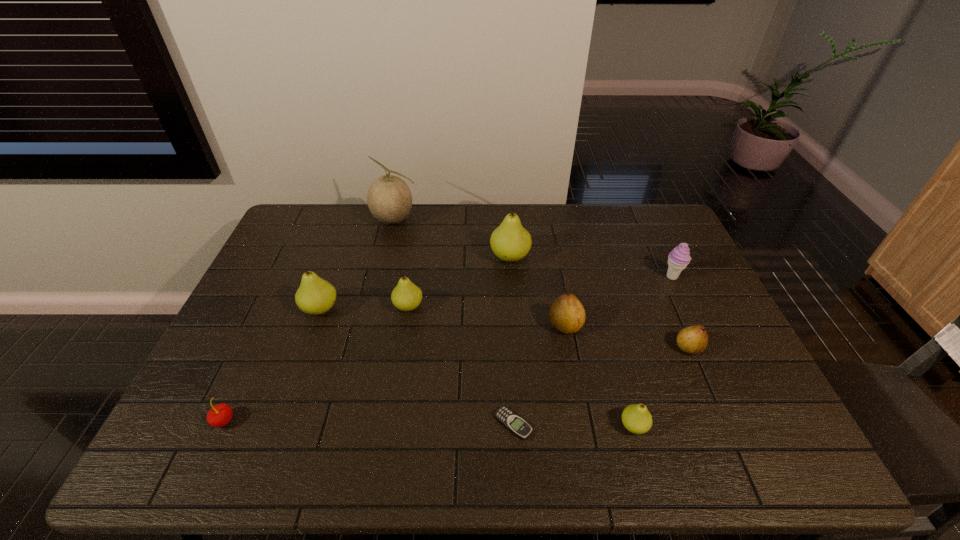
In the image, there is a desktop. Find the location of `free region at the far right corner`. free region at the far right corner is located at coordinates (628, 222).

The image size is (960, 540). What are the coordinates of `blank region between the leftmost object and the gray beeper` in the screenshot? It's located at (369, 422).

Find the location of a particular element. The height and width of the screenshot is (540, 960). free space between the second green pear from right to left and the ninth object from right to left is located at coordinates (416, 283).

The image size is (960, 540). I want to click on free space between the gray beeper and the second green pear from right to left, so click(x=512, y=341).

Identify the location of unoccupied area between the rightmost pear and the cantaloup. (541, 284).

Find the location of `vacant area between the gray beeper and the tallest pear`. vacant area between the gray beeper and the tallest pear is located at coordinates (512, 341).

The width and height of the screenshot is (960, 540). In order to click on vacant space that is in between the fifth shortest pear and the beeper in this screenshot , I will do `click(417, 367)`.

At what (x,y) coordinates should I click in order to perform the action: click on vacant area between the second biggest green pear and the farthest green pear. Please return your answer as a coordinate pair (x, y). This screenshot has height=540, width=960. Looking at the image, I should click on (416, 283).

This screenshot has width=960, height=540. I want to click on free space between the nearest green pear and the rightmost pear, so click(661, 387).

This screenshot has width=960, height=540. In order to click on free space between the fifth pear from right to left and the red cherry in this screenshot , I will do `click(316, 363)`.